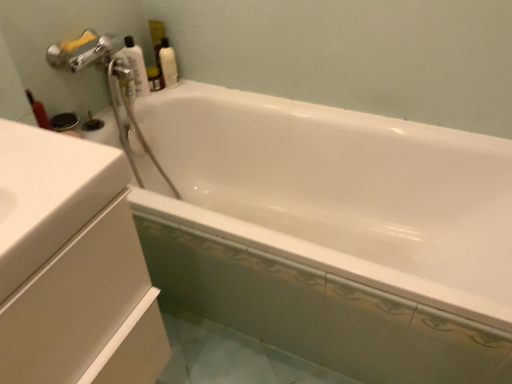
Question: Considering their positions, is white glossy bottle at upper left, the first cleaning product positioned from the left, located in front of or behind white glossy cabinet at left?

Choices:
 (A) front
 (B) behind

Answer: (B)

Question: Do you think white glossy bottle at upper left, the first cleaning product positioned from the left, is within white glossy cabinet at left, or outside of it?

Choices:
 (A) outside
 (B) inside

Answer: (A)

Question: Which of these objects is positioned farthest from the white glossy bottle at upper right, placed as the second cleaning product when sorted from left to right?

Choices:
 (A) white glossy cabinet at left
 (B) white glossy bottle at upper left, the first cleaning product positioned from the left
 (C) white glossy bathtub at upper center

Answer: (A)

Question: Considering the real-world distances, which object is farthest from the white glossy bathtub at upper center?

Choices:
 (A) white glossy cabinet at left
 (B) white glossy bottle at upper left, the first cleaning product positioned from the left
 (C) white glossy bottle at upper right, the 1th cleaning product in the right-to-left sequence

Answer: (A)